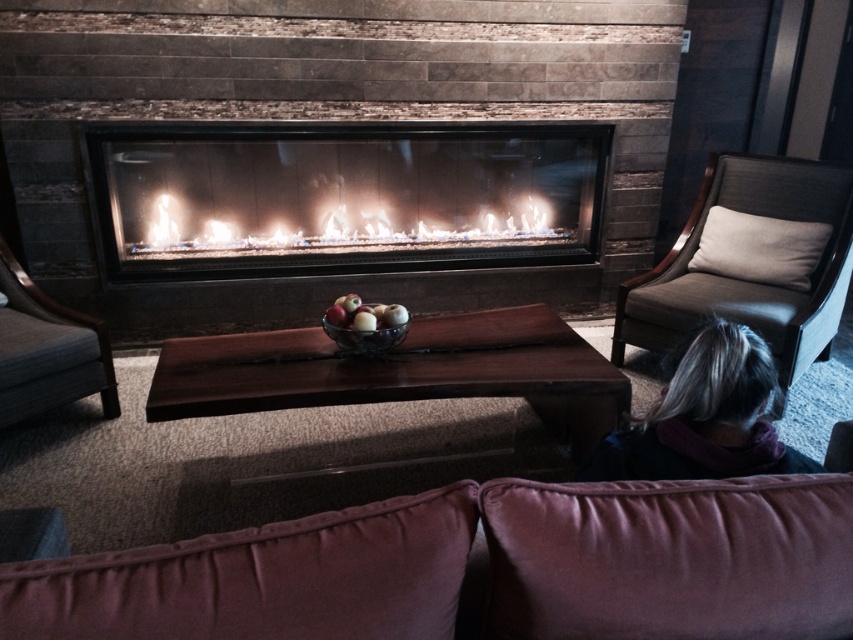
In the scene shown: You are standing at the origin point in the room and want to move towards the dark gray fabric armchair at left. What are the coordinates you need to move to reach it?

The dark gray fabric armchair at left is located at coordinates point (47, 349), so you need to move to those coordinates to reach it.

You are standing at the point (720, 376) and want to walk to the fireplace. The room is 2 meters wide. Can you reach the fireplace without crossing the coffee table?

The distance between you at point (720, 376) and the fireplace is 1.20 meters. Since the room is 2 meters wide, you can walk around the coffee table to reach the fireplace without crossing it.